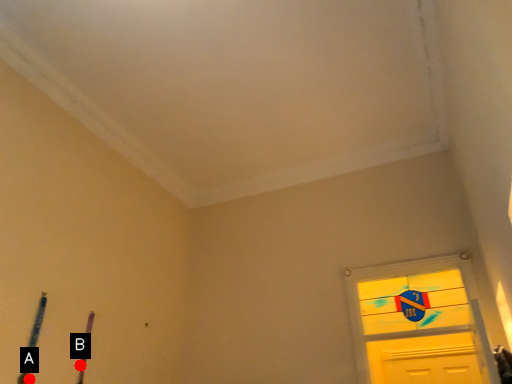
Question: Two points are circled on the image, labeled by A and B beside each circle. Which point appears farthest from the camera in this image?

Choices:
 (A) A is further
 (B) B is further

Answer: (B)